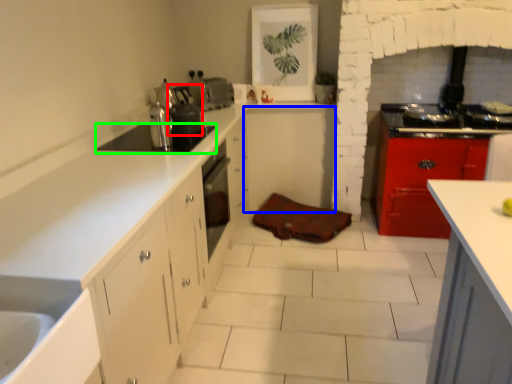
Question: Which object is the farthest from appliance (highlighted by a red box)? Choose among these: cabinetry (highlighted by a blue box) or appliance (highlighted by a green box).

Choices:
 (A) cabinetry
 (B) appliance

Answer: (A)